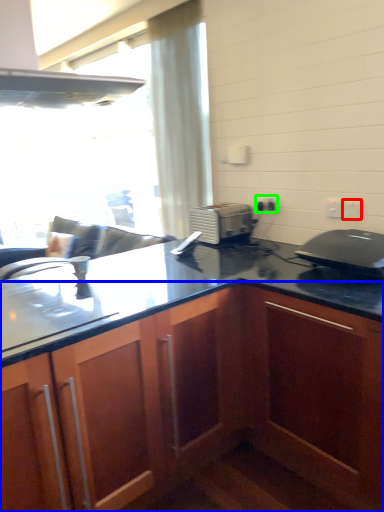
Question: Estimate the real-world distances between objects in this image. Which object is farther from electric outlet (highlighted by a red box), cabinetry (highlighted by a blue box) or electric outlet (highlighted by a green box)?

Choices:
 (A) cabinetry
 (B) electric outlet

Answer: (A)